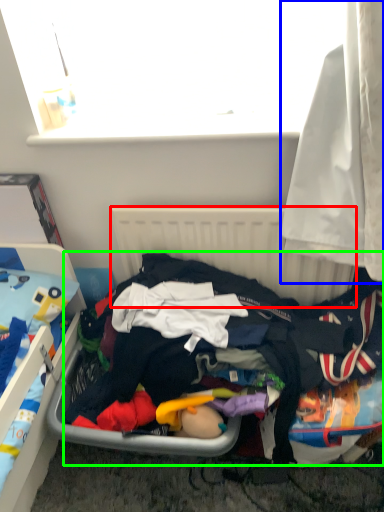
Question: Which is nearer to the radiator (highlighted by a red box)? curtain (highlighted by a blue box) or clothing (highlighted by a green box).

Choices:
 (A) curtain
 (B) clothing

Answer: (B)